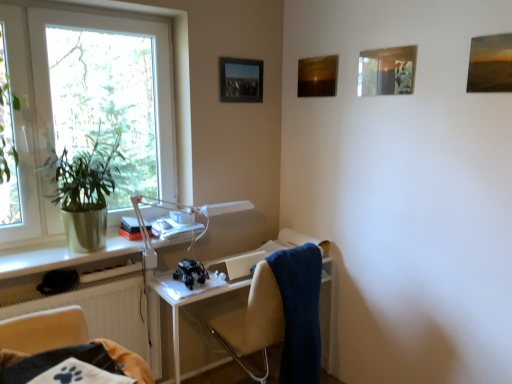
Where is `blank space situated above white plastic window at left (from a real-world perspective)`? blank space situated above white plastic window at left (from a real-world perspective) is located at coordinates (x=75, y=7).